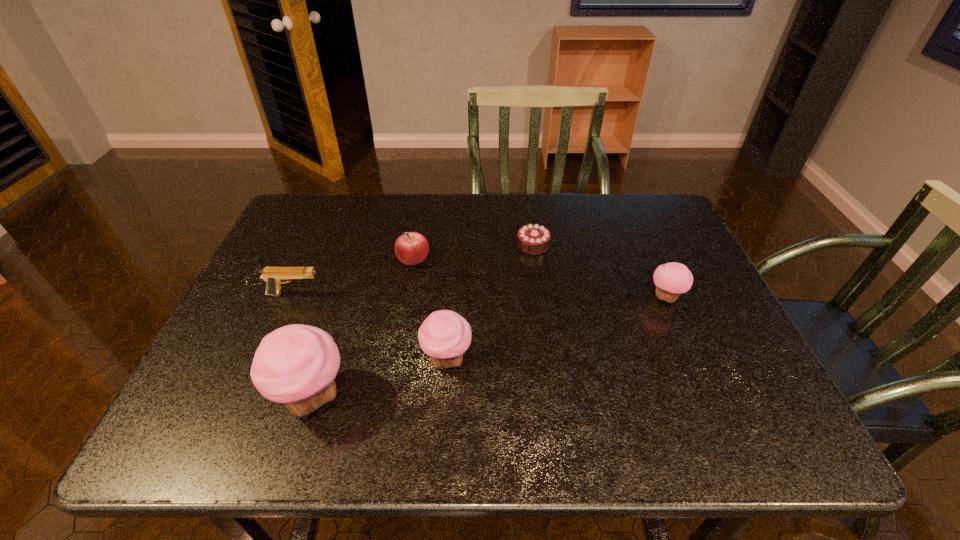
At what (x,y) coordinates should I click in order to perform the action: click on vacant point at the near edge. Please return your answer as a coordinate pair (x, y). This screenshot has height=540, width=960. Looking at the image, I should click on (584, 387).

Find the location of `vacant space at the left edge of the desktop`. vacant space at the left edge of the desktop is located at coordinates (250, 293).

The width and height of the screenshot is (960, 540). Identify the location of free region at the right edge of the desktop. (696, 330).

Where is `free spot at the far left corner of the desktop`? Image resolution: width=960 pixels, height=540 pixels. free spot at the far left corner of the desktop is located at coordinates (348, 193).

Where is `free location at the near left corner`? This screenshot has width=960, height=540. free location at the near left corner is located at coordinates (218, 393).

Locate an element on the screen. This screenshot has width=960, height=540. free location at the far right corner is located at coordinates (656, 195).

You are a GUI agent. You are given a task and a screenshot of the screen. Output one action in this format:
    pyautogui.click(x=<x>, y=<y>)
    Task: Click on the vacant area at the near right corner of the desktop
    
    Given the screenshot: What is the action you would take?
    (697, 382)

Where is `vacant point located between the pistol and the shortest cupcake`? This screenshot has width=960, height=540. vacant point located between the pistol and the shortest cupcake is located at coordinates (480, 296).

Identify the location of vacant region between the tallest cupcake and the apple. (363, 328).

Identify the location of blank region between the pistol and the farthest cupcake. (480, 296).